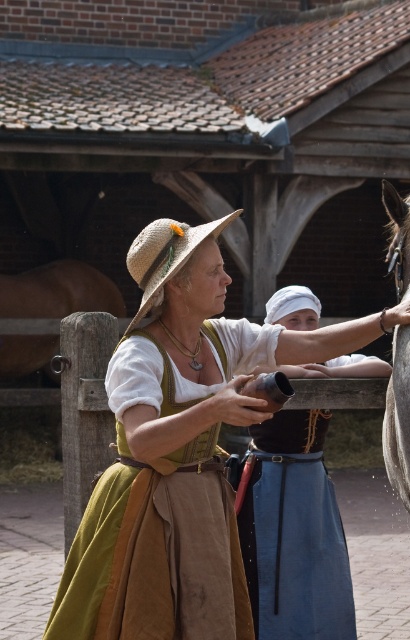
You are standing at the camera position and need to hand a small note to the person wearing the matte straw hat at center. The note requires precise delivery. Considering the distance, can you comfortably reach them without moving closer?

The matte straw hat at center is 4.00 meters from the camera. Since the distance is 4 meters, you would need to move closer to comfortably reach them with the note.

You are a merchant in this medieval scene and need to determine which item takes up more horizontal space between the matte brown leather purse at center and the brown leather horse at right. Which one is wider?

The matte brown leather purse at center is wider than the brown leather horse at right.